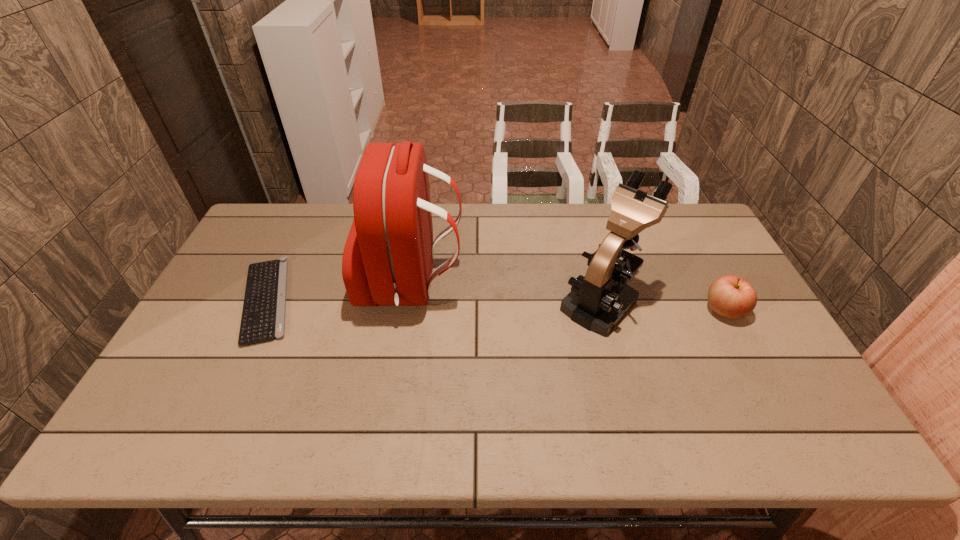
Locate an element on the screen. The width and height of the screenshot is (960, 540). vacant point located between the second object from left to right and the shortest object is located at coordinates (339, 292).

Image resolution: width=960 pixels, height=540 pixels. Identify the location of vacant area that lies between the second object from left to right and the second tallest object. (507, 293).

This screenshot has width=960, height=540. Find the location of `vacant region between the second object from left to right and the leftmost object`. vacant region between the second object from left to right and the leftmost object is located at coordinates (339, 292).

Where is `vacant area that lies between the third shortest object and the shortest object`? This screenshot has height=540, width=960. vacant area that lies between the third shortest object and the shortest object is located at coordinates (434, 301).

Find the location of `empty space between the tallest object and the leftmost object`. empty space between the tallest object and the leftmost object is located at coordinates (339, 292).

Locate which object is the third closest to the tallest object. Please provide its 2D coordinates. Your answer should be formatted as a tuple, i.e. [(x, y)], where the tuple contains the x and y coordinates of a point satisfying the conditions above.

[(730, 296)]

Identify the location of object that stands as the closest to the third object from left to right. The image size is (960, 540). (730, 296).

You are a GUI agent. You are given a task and a screenshot of the screen. Output one action in this format:
    pyautogui.click(x=<x>, y=<y>)
    Task: Click on the vacant region that satisfies the following two spatial constraints: 1. on the back side of the rightmost object; 2. on the strap side of the tallest object
    
    Given the screenshot: What is the action you would take?
    pyautogui.click(x=710, y=285)

Locate an element on the screen. This screenshot has height=540, width=960. free spot that satisfies the following two spatial constraints: 1. on the strap side of the second object from left to right; 2. on the back side of the third shortest object is located at coordinates (410, 302).

This screenshot has height=540, width=960. In order to click on vacant space that satisfies the following two spatial constraints: 1. on the strap side of the tallest object; 2. on the left side of the third object from left to right in this screenshot , I will do [410, 302].